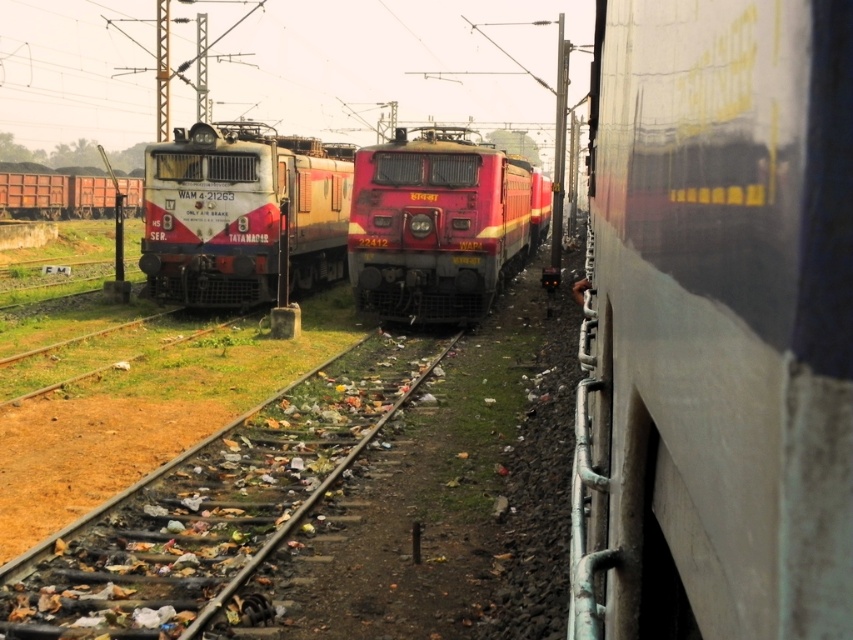
Question: Which point is closer to the camera?

Choices:
 (A) (250, 164)
 (B) (485, 200)

Answer: (B)

Question: Which object appears closest to the camera in this image?

Choices:
 (A) matte red train at center
 (B) matte red locomotive at center

Answer: (B)

Question: Is matte red locomotive at center wider than matte red train at center?

Choices:
 (A) yes
 (B) no

Answer: (B)

Question: Is matte red locomotive at center bigger than matte red train at center?

Choices:
 (A) yes
 (B) no

Answer: (B)

Question: Is matte red locomotive at center closer to camera compared to matte red train at center?

Choices:
 (A) yes
 (B) no

Answer: (A)

Question: Among these objects, which one is farthest from the camera?

Choices:
 (A) matte red train at center
 (B) matte red locomotive at center

Answer: (A)